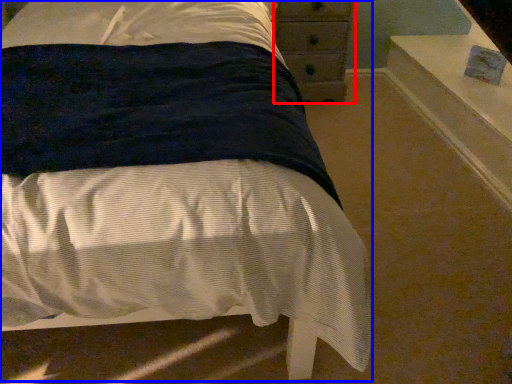
Question: Which object appears closest to the camera in this image, chest of drawers (highlighted by a red box) or bed (highlighted by a blue box)?

Choices:
 (A) chest of drawers
 (B) bed

Answer: (B)